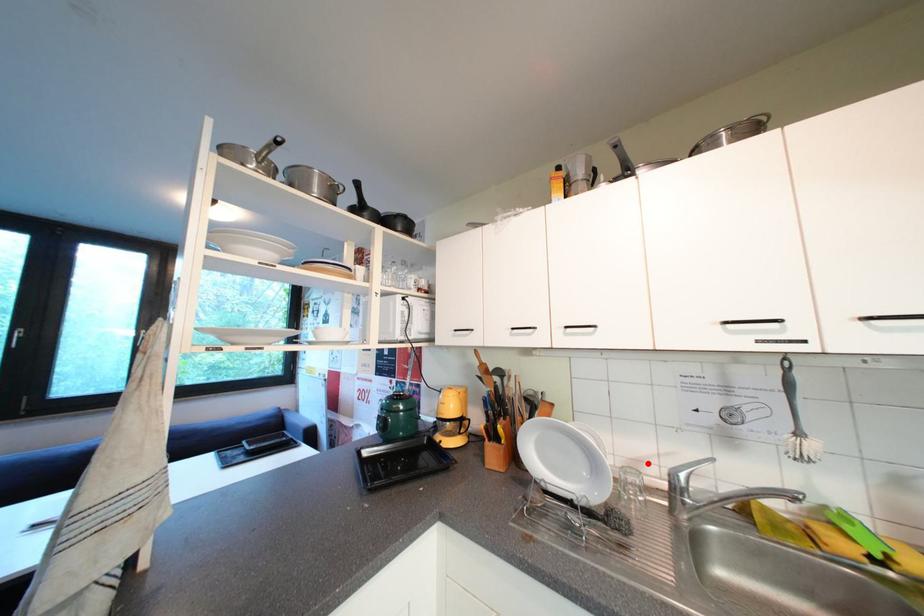
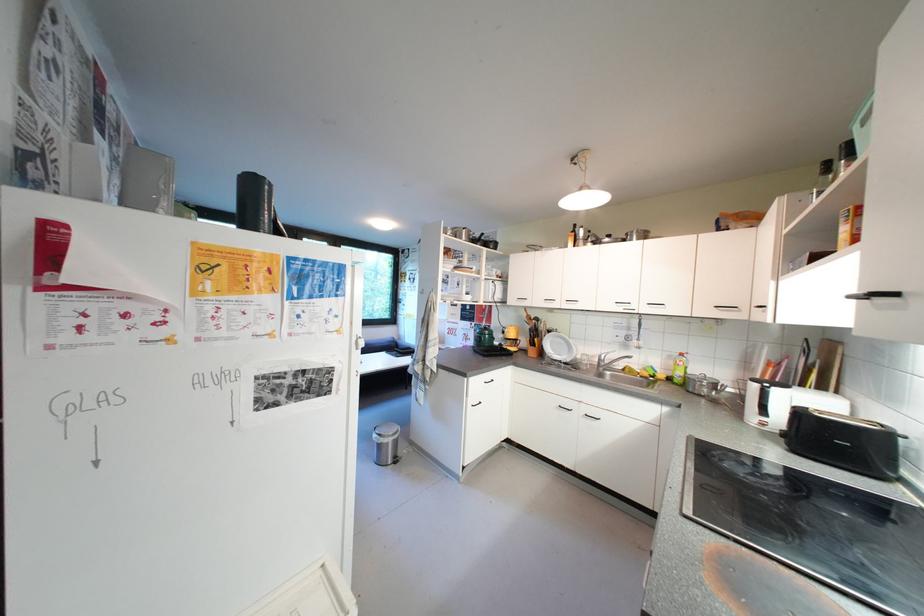
Question: I am providing you with two images of the same scene from different viewpoints. A red point is marked on the first image. Can you still see the location of the red point in image 2?

Choices:
 (A) Yes
 (B) No

Answer: (A)